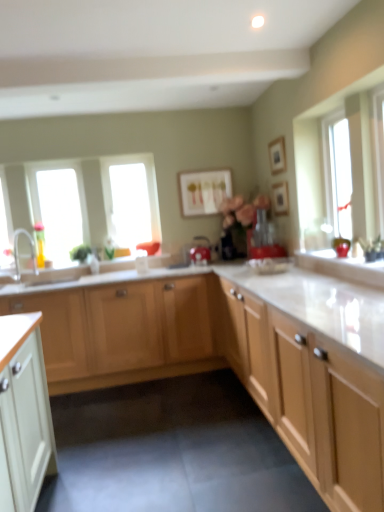
What do you see at coordinates (200, 250) in the screenshot? I see `matte red kettle at center, which appears as the 2th appliance when viewed from the right` at bounding box center [200, 250].

This screenshot has width=384, height=512. Identify the location of transparent glass window at center, the second window in the left-to-right sequence. (127, 203).

This screenshot has height=512, width=384. What do you see at coordinates (58, 211) in the screenshot? I see `transparent glass window at left, which is counted as the 2th window, starting from the back` at bounding box center [58, 211].

What is the approximate width of wooden picture frame at upper center, the 2th picture frame viewed from the left?

1.51 inches.

Find the location of a particular element. The image size is (384, 512). light wood cabinet at center, the 2th cabinetry positioned from the back is located at coordinates (238, 355).

From a real-world perspective, which object stands above the other?

transparent glass window at left, which is counted as the 2th window, starting from the back, from a real-world perspective.

Could you tell me if light wood cabinet at center, the 2th cabinetry viewed from the front, is turned towards transparent glass window at left, acting as the 1th window starting from the left?

No, light wood cabinet at center, the 2th cabinetry viewed from the front, is not facing towards transparent glass window at left, acting as the 1th window starting from the left.

Is light wood cabinet at center, the 2th cabinetry viewed from the front, outside of transparent glass window at left, which is counted as the 2th window, starting from the back?

That's correct, light wood cabinet at center, the 2th cabinetry viewed from the front, is outside of transparent glass window at left, which is counted as the 2th window, starting from the back.

Is transparent glass window at center, positioned as the 1th window in back-to-front order, to the right of transparent glass window at left, which is the second window in front-to-back order, from the viewer's perspective?

Yes, transparent glass window at center, positioned as the 1th window in back-to-front order, is to the right of transparent glass window at left, which is the second window in front-to-back order.

Between transparent glass window at center, positioned as the 1th window in back-to-front order, and transparent glass window at left, acting as the 1th window starting from the left, which one is positioned behind?

transparent glass window at center, positioned as the 1th window in back-to-front order, is further away from the camera.

Based on the photo, how different are the orientations of transparent glass window at center, positioned as the 1th window in back-to-front order, and transparent glass window at left, which is the second window in front-to-back order, in degrees?

The angle between the facing direction of transparent glass window at center, positioned as the 1th window in back-to-front order, and the facing direction of transparent glass window at left, which is the second window in front-to-back order, is 1.04 degrees.

Are transparent glass window at center, positioned as the 1th window in back-to-front order, and transparent glass window at left, acting as the 1th window starting from the left, located far from each other?

No, transparent glass window at center, positioned as the 1th window in back-to-front order, is not far from transparent glass window at left, acting as the 1th window starting from the left.

In terms of height, does wooden picture frame at upper center, the 2th picture frame viewed from the left, look taller or shorter compared to wooden picture frame at upper center, the third picture frame in the left-to-right sequence?

Considering their sizes, wooden picture frame at upper center, the 2th picture frame viewed from the left, has more height than wooden picture frame at upper center, the third picture frame in the left-to-right sequence.

Is wooden picture frame at upper center, acting as the first picture frame starting from the front, bigger than wooden picture frame at upper center, which is the first picture frame in right-to-left order?

Yes.

From a real-world perspective, count 2nd picture frames upward from the wooden picture frame at upper center, acting as the 2th picture frame starting from the front, and point to it. Please provide its 2D coordinates.

[(277, 155)]

Is wooden picture frame at upper center, acting as the 2th picture frame starting from the front, not inside transparent glass window at center, positioned as the 1th window in back-to-front order?

Yes, wooden picture frame at upper center, acting as the 2th picture frame starting from the front, is located beyond the bounds of transparent glass window at center, positioned as the 1th window in back-to-front order.

Is wooden picture frame at upper center, acting as the 2th picture frame starting from the front, to the left or to the right of transparent glass window at center, positioned as the 1th window in back-to-front order, in the image?

Based on their positions, wooden picture frame at upper center, acting as the 2th picture frame starting from the front, is located to the right of transparent glass window at center, positioned as the 1th window in back-to-front order.

Considering the positions of objects wooden picture frame at upper center, which is the first picture frame in right-to-left order, and transparent glass window at center, which is counted as the 2th window, starting from the right, in the image provided, who is in front, wooden picture frame at upper center, which is the first picture frame in right-to-left order, or transparent glass window at center, which is counted as the 2th window, starting from the right,?

wooden picture frame at upper center, which is the first picture frame in right-to-left order, is in front.

Is transparent glass window at center, which is counted as the 2th window, starting from the right, at the back of wooden picture frame at upper center, which is the first picture frame in right-to-left order?

No, wooden picture frame at upper center, which is the first picture frame in right-to-left order,'s orientation is not away from transparent glass window at center, which is counted as the 2th window, starting from the right.

Which window is the 2nd one when counting from the left side of the matte red blender at center, the first appliance in the right-to-left sequence? Please provide its 2D coordinates.

[(58, 211)]

Measure the distance from matte red blender at center, arranged as the 2th appliance when viewed from the left, to transparent glass window at left, acting as the 1th window starting from the left.

matte red blender at center, arranged as the 2th appliance when viewed from the left, and transparent glass window at left, acting as the 1th window starting from the left, are 1.81 meters apart from each other.

Is matte red blender at center, the first appliance in the right-to-left sequence, beside transparent glass window at left, which is counted as the third window, starting from the right?

No.

Can you confirm if matte red blender at center, arranged as the 2th appliance when viewed from the left, is shorter than transparent glass window at left, which is the second window in front-to-back order?

Indeed, matte red blender at center, arranged as the 2th appliance when viewed from the left, has a lesser height compared to transparent glass window at left, which is the second window in front-to-back order.

Is matte red blender at center, acting as the first appliance starting from the front, facing towards wooden picture frame at upper center, the 2th picture frame positioned from the back?

No, matte red blender at center, acting as the first appliance starting from the front, is not oriented towards wooden picture frame at upper center, the 2th picture frame positioned from the back.

Is matte red blender at center, the first appliance in the right-to-left sequence, taller than wooden picture frame at upper center, acting as the 2th picture frame starting from the front?

Indeed, matte red blender at center, the first appliance in the right-to-left sequence, has a greater height compared to wooden picture frame at upper center, acting as the 2th picture frame starting from the front.

Does matte red blender at center, the first appliance in the right-to-left sequence, touch wooden picture frame at upper center, acting as the 2th picture frame starting from the front?

No, matte red blender at center, the first appliance in the right-to-left sequence, is not beside wooden picture frame at upper center, acting as the 2th picture frame starting from the front.

Is point (286, 254) positioned in front of point (281, 184)?

Yes, it is in front of point (281, 184).

Does light wood cabinet at center, the 2th cabinetry positioned from the back, lie behind light wood cabinet at center, which is the 1th cabinetry from back to front?

No, it is not.

Is light wood cabinet at center, which is the first cabinetry in front-to-back order, completely or partially outside of light wood cabinet at center, which is the 1th cabinetry from back to front?

Yes, light wood cabinet at center, which is the first cabinetry in front-to-back order, is outside of light wood cabinet at center, which is the 1th cabinetry from back to front.

Is light wood cabinet at center, the 2th cabinetry viewed from the front, at the back of light wood cabinet at center, the 2th cabinetry positioned from the back?

Yes.

From the picture: Based on their positions, is light wood cabinet at center, which is the first cabinetry in front-to-back order, located to the left or right of light wood cabinet at center, which is the 1th cabinetry from back to front?

In the image, light wood cabinet at center, which is the first cabinetry in front-to-back order, appears on the right side of light wood cabinet at center, which is the 1th cabinetry from back to front.

Locate an element on the screen. This screenshot has width=384, height=512. the 2nd window to the left of the light wood cabinet at center, the 2th cabinetry viewed from the front, starting your count from the anchor is located at coordinates click(x=58, y=211).

The height and width of the screenshot is (512, 384). In order to click on window below the transparent glass window at center, which is counted as the 2th window, starting from the right (from the image's perspective) in this screenshot , I will do `click(58, 211)`.

Considering their positions, is matte red kettle at center, which appears as the 2th appliance when viewed from the right, positioned further to light wood cabinet at center, the 2th cabinetry viewed from the front, than wooden picture frame at upper center, the 2th picture frame positioned from the back?

Based on the image, wooden picture frame at upper center, the 2th picture frame positioned from the back, appears to be further to light wood cabinet at center, the 2th cabinetry viewed from the front.

Considering their positions, is light wood cabinet at center, the 2th cabinetry viewed from the front, positioned closer to matte white picture frame at center, the third picture frame viewed from the front, than transparent glass window at center, which is counted as the 2th window, starting from the right?

Among the two, transparent glass window at center, which is counted as the 2th window, starting from the right, is located nearer to matte white picture frame at center, the third picture frame viewed from the front.

Looking at the image, which one is located closer to matte white picture frame at center, the 1th picture frame in the back-to-front sequence, transparent glass window at upper right, which is counted as the first window, starting from the right, or silver metallic faucet at left?

Among the two, transparent glass window at upper right, which is counted as the first window, starting from the right, is located nearer to matte white picture frame at center, the 1th picture frame in the back-to-front sequence.

Based on their spatial positions, is matte red kettle at center, the second appliance in the front-to-back sequence, or transparent glass window at left, which is counted as the third window, starting from the right, further from transparent glass window at center, positioned as the 1th window in back-to-front order?

The object further to transparent glass window at center, positioned as the 1th window in back-to-front order, is matte red kettle at center, the second appliance in the front-to-back sequence.

Looking at the image, which one is located further to silver metallic faucet at left, matte red kettle at center, the second appliance in the front-to-back sequence, or wooden picture frame at upper center, the second picture frame when ordered from right to left?

wooden picture frame at upper center, the second picture frame when ordered from right to left.

Which object lies further to the anchor point transparent glass window at upper right, which is counted as the first window, starting from the right, matte red kettle at center, which appears as the 2th appliance when viewed from the right, or matte red blender at center, the first appliance in the right-to-left sequence?

matte red kettle at center, which appears as the 2th appliance when viewed from the right.

Estimate the real-world distances between objects in this image. Which object is further from transparent glass window at left, which is the second window in front-to-back order, light wood cabinet at center, the 2th cabinetry viewed from the front, or wooden picture frame at upper center, the 2th picture frame positioned from the back?

wooden picture frame at upper center, the 2th picture frame positioned from the back.

Looking at this image, from the image, which object appears to be nearer to matte red kettle at center, the second appliance in the front-to-back sequence, silver metallic faucet at left or wooden picture frame at upper center, the third picture frame in the left-to-right sequence?

wooden picture frame at upper center, the third picture frame in the left-to-right sequence, is closer to matte red kettle at center, the second appliance in the front-to-back sequence.

Locate an element on the screen. The height and width of the screenshot is (512, 384). appliance between matte red kettle at center, which appears as the 2th appliance when viewed from the right, and wooden picture frame at upper center, acting as the 2th picture frame starting from the front, in the horizontal direction is located at coordinates (263, 239).

This screenshot has width=384, height=512. I want to click on window located between transparent glass window at left, which is counted as the 2th window, starting from the back, and transparent glass window at upper right, the first window positioned from the front, in the left-right direction, so click(127, 203).

At what (x,y) coordinates should I click in order to perform the action: click on cabinetry between light wood cabinet at center, which is the first cabinetry in front-to-back order, and matte red kettle at center, which appears as the 2th appliance when viewed from the right, along the z-axis. Please return your answer as a coordinate pair (x, y). The width and height of the screenshot is (384, 512). Looking at the image, I should click on (125, 331).

Find the location of `window between light wood cabinet at center, which is the first cabinetry in front-to-back order, and transparent glass window at left, acting as the 1th window starting from the left, in the front-back direction`. window between light wood cabinet at center, which is the first cabinetry in front-to-back order, and transparent glass window at left, acting as the 1th window starting from the left, in the front-back direction is located at coordinates (333, 166).